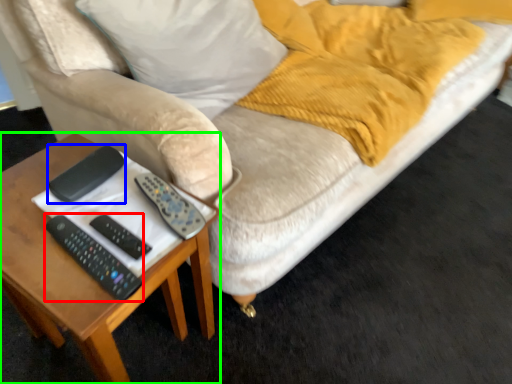
Question: Based on their relative distances, which object is nearer to remote (highlighted by a red box)? Choose from gadget (highlighted by a blue box) and table (highlighted by a green box).

Choices:
 (A) gadget
 (B) table

Answer: (A)